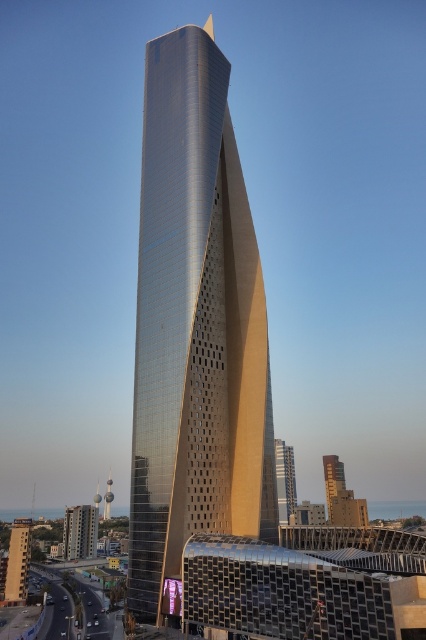
Question: Does gold textured tower at center lie in front of shiny metallic tower at center?

Choices:
 (A) no
 (B) yes

Answer: (B)

Question: Is the position of gold metallic building at center less distant than that of gold textured tower at center?

Choices:
 (A) no
 (B) yes

Answer: (B)

Question: Is shiny glass skyscraper at center thinner than gold metallic building at center?

Choices:
 (A) no
 (B) yes

Answer: (A)

Question: Which point is farther from the camera taking this photo?

Choices:
 (A) (14, 564)
 (B) (167, 202)
 (C) (336, 497)
 (D) (278, 500)

Answer: (C)

Question: Which point is farther to the camera?

Choices:
 (A) gold textured glass tower at center
 (B) gold textured tower at center

Answer: (B)

Question: Among these objects, which one is nearest to the camera?

Choices:
 (A) gold metallic building at center
 (B) shiny glass skyscraper at center

Answer: (B)